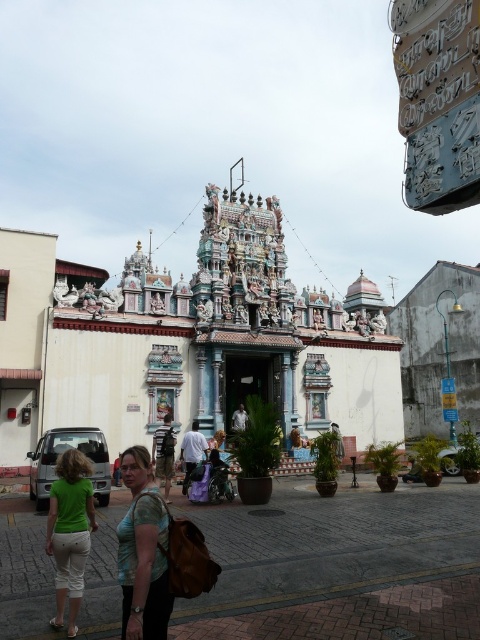
Is point (296, 417) closer to camera compared to point (195, 464)?

No, it is behind (195, 464).

Does white painted temple at center appear on the left side of white fabric pants at center?

Correct, you'll find white painted temple at center to the left of white fabric pants at center.

This screenshot has height=640, width=480. Identify the location of white painted temple at center. (223, 340).

Between green matte shorts at lower left and light brown fabric shirt at center, which one appears on the right side from the viewer's perspective?

From the viewer's perspective, light brown fabric shirt at center appears more on the right side.

Is green matte shorts at lower left below light brown fabric shirt at center?

No, green matte shorts at lower left is not below light brown fabric shirt at center.

What do you see at coordinates (70, 532) in the screenshot? The image size is (480, 640). I see `green matte shorts at lower left` at bounding box center [70, 532].

Where is `green matte shorts at lower left`? This screenshot has width=480, height=640. green matte shorts at lower left is located at coordinates (70, 532).

Can you confirm if green fabric shirt at center is positioned above light brown fabric shirt at center?

Incorrect, green fabric shirt at center is not positioned above light brown fabric shirt at center.

Between point (134, 580) and point (167, 435), which one is positioned in front?

Point (134, 580)

You are a GUI agent. You are given a task and a screenshot of the screen. Output one action in this format:
    pyautogui.click(x=<x>, y=<y>)
    Task: Click on the green fabric shirt at center
    The width and height of the screenshot is (480, 640).
    Given the screenshot: What is the action you would take?
    pyautogui.click(x=143, y=552)